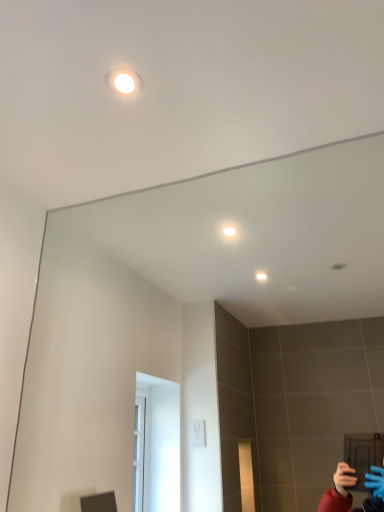
Question: From a real-world perspective, is transparent glass mirror at upper center above or below white glossy light at upper center?

Choices:
 (A) above
 (B) below

Answer: (B)

Question: From the image's perspective, relative to white glossy light at upper center, is transparent glass mirror at upper center above or below?

Choices:
 (A) below
 (B) above

Answer: (A)

Question: Relative to white glossy light at upper center, is transparent glass mirror at upper center in front or behind?

Choices:
 (A) behind
 (B) front

Answer: (B)

Question: From the image's perspective, relative to transparent glass mirror at upper center, is white glossy light at upper center above or below?

Choices:
 (A) below
 (B) above

Answer: (B)

Question: Would you say white glossy light at upper center is to the left or to the right of transparent glass mirror at upper center in the picture?

Choices:
 (A) left
 (B) right

Answer: (A)

Question: Considering the positions of white glossy light at upper center and transparent glass mirror at upper center in the image, is white glossy light at upper center bigger or smaller than transparent glass mirror at upper center?

Choices:
 (A) big
 (B) small

Answer: (B)

Question: Considering the positions of white glossy light at upper center and transparent glass mirror at upper center in the image, is white glossy light at upper center taller or shorter than transparent glass mirror at upper center?

Choices:
 (A) tall
 (B) short

Answer: (B)